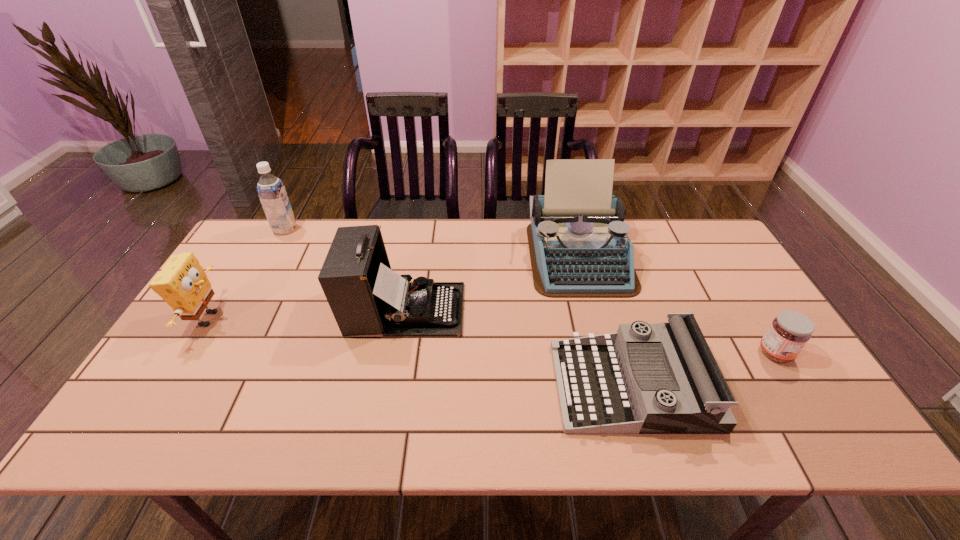
Where is `soya milk`? soya milk is located at coordinates (271, 191).

Where is `the fourth object from right to left`? Image resolution: width=960 pixels, height=540 pixels. the fourth object from right to left is located at coordinates (366, 297).

Find the location of a particular element. sponge is located at coordinates (182, 283).

Locate an element on the screen. Image resolution: width=960 pixels, height=540 pixels. the shortest typewriter is located at coordinates (662, 378).

The width and height of the screenshot is (960, 540). I want to click on the rightmost object, so click(789, 332).

Identify the location of free space located on the label of the soya milk. (388, 230).

Locate an element on the screen. free space located 0.120m inside the open case of the leftmost typewriter is located at coordinates (507, 309).

What are the coordinates of `free space located 0.200m on the face of the sponge` in the screenshot? It's located at (297, 319).

Locate an element on the screen. vacant space located on the typing side of the nearest typewriter is located at coordinates (498, 386).

Identify the location of free space located 0.130m on the typing side of the nearest typewriter. This screenshot has width=960, height=540. (502, 386).